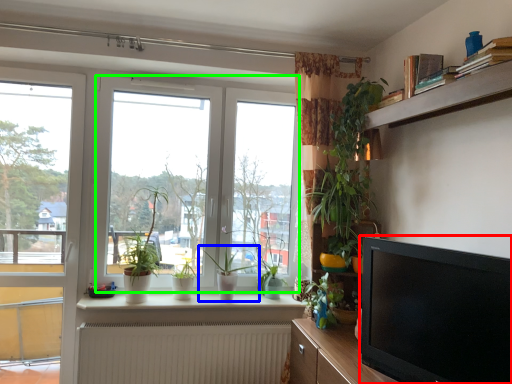
Question: Which object is the farthest from television (highlighted by a red box)? Choose among these: houseplant (highlighted by a blue box) or window (highlighted by a green box).

Choices:
 (A) houseplant
 (B) window

Answer: (B)